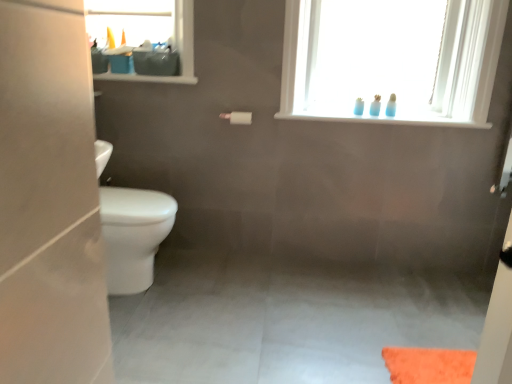
Question: Are transparent glass bottles at upper center and white matte toilet paper at center far apart?

Choices:
 (A) no
 (B) yes

Answer: (A)

Question: Is white matte toilet paper at center a part of transparent glass bottles at upper center?

Choices:
 (A) no
 (B) yes

Answer: (A)

Question: Is transparent glass bottles at upper center wider than white matte toilet paper at center?

Choices:
 (A) no
 (B) yes

Answer: (B)

Question: From the image's perspective, is transparent glass bottles at upper center on white matte toilet paper at center?

Choices:
 (A) yes
 (B) no

Answer: (A)

Question: Does transparent glass bottles at upper center have a lesser width compared to white matte toilet paper at center?

Choices:
 (A) no
 (B) yes

Answer: (A)

Question: Considering the relative sizes of transparent glass bottles at upper center and white matte toilet paper at center in the image provided, is transparent glass bottles at upper center bigger than white matte toilet paper at center?

Choices:
 (A) no
 (B) yes

Answer: (B)

Question: Can you confirm if blue plastic toothbrushes at upper right, the second toiletry from the right, is shorter than white matte toilet paper at center?

Choices:
 (A) no
 (B) yes

Answer: (A)

Question: Could you tell me if blue plastic toothbrushes at upper right, the 2th toiletry in the left-to-right sequence, is facing white matte toilet paper at center?

Choices:
 (A) yes
 (B) no

Answer: (B)

Question: Would you say blue plastic toothbrushes at upper right, the 2th toiletry in the left-to-right sequence, is outside white matte toilet paper at center?

Choices:
 (A) yes
 (B) no

Answer: (A)

Question: Can you confirm if blue plastic toothbrushes at upper right, the second toiletry from the right, is wider than white matte toilet paper at center?

Choices:
 (A) yes
 (B) no

Answer: (B)

Question: From a real-world perspective, is blue plastic toothbrushes at upper right, the 2th toiletry in the left-to-right sequence, physically above white matte toilet paper at center?

Choices:
 (A) no
 (B) yes

Answer: (B)

Question: From the image's perspective, is blue plastic toothbrushes at upper right, the 2th toiletry in the left-to-right sequence, beneath white matte toilet paper at center?

Choices:
 (A) no
 (B) yes

Answer: (A)

Question: Is translucent plastic bottles at upper center, which is the 3th toiletry in right-to-left order, further to camera compared to transparent glass bottles at upper center?

Choices:
 (A) no
 (B) yes

Answer: (B)